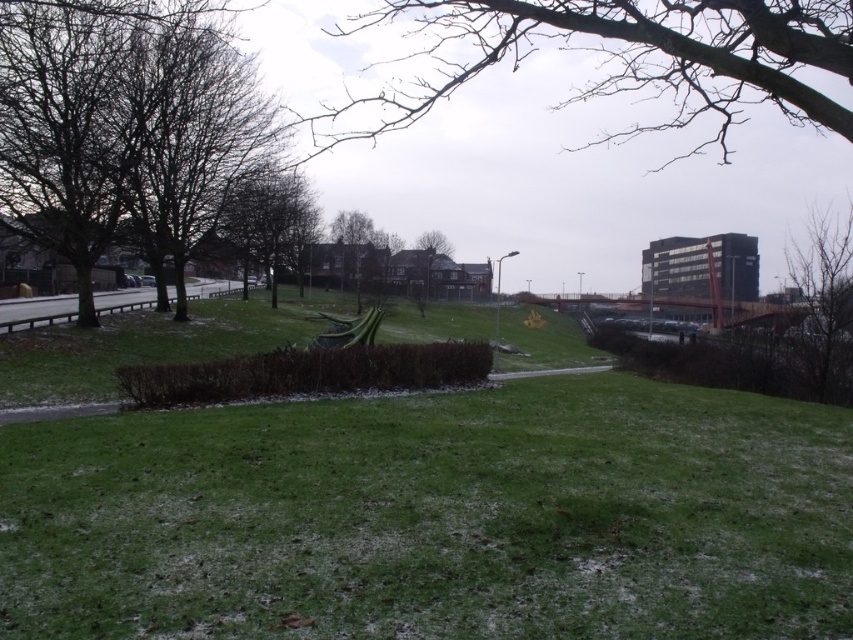
You are standing in the park and looking towards the buildings. Which of the two objects, the bare branches at left or the bare branches at upper center, is closer to you?

The bare branches at left are closer to you because the bare branches at upper center is behind bare branches at left.

You are a bird looking for a place to perch. You see the bare branches at left and the bare branches at upper center. Which set of branches would you choose if you prefer smaller perches?

The bare branches at left has a smaller size compared to bare branches at upper center, so you should choose the bare branches at left for a smaller perch.